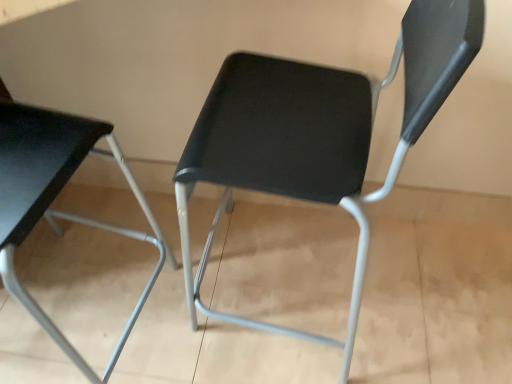
Question: From a real-world perspective, is matte black chair at left, arranged as the 1th chair when viewed from the left, above or below matte black chair at center, positioned as the 2th chair in left-to-right order?

Choices:
 (A) above
 (B) below

Answer: (A)

Question: Does point (33, 168) appear closer or farther from the camera than point (326, 71)?

Choices:
 (A) farther
 (B) closer

Answer: (B)

Question: Is matte black chair at left, arranged as the 1th chair when viewed from the left, wider or thinner than matte black chair at center, positioned as the 2th chair in left-to-right order?

Choices:
 (A) thin
 (B) wide

Answer: (B)

Question: Visually, is matte black chair at center, the first chair in the right-to-left sequence, positioned to the left or to the right of matte black chair at left, which is counted as the 2th chair, starting from the right?

Choices:
 (A) right
 (B) left

Answer: (A)

Question: In the image, is matte black chair at center, the first chair in the right-to-left sequence, positioned in front of or behind matte black chair at left, arranged as the 1th chair when viewed from the left?

Choices:
 (A) front
 (B) behind

Answer: (B)

Question: Considering the positions of point (189, 135) and point (7, 251), is point (189, 135) closer or farther from the camera than point (7, 251)?

Choices:
 (A) closer
 (B) farther

Answer: (B)

Question: Is matte black chair at center, positioned as the 2th chair in left-to-right order, inside the boundaries of matte black chair at left, which is counted as the 2th chair, starting from the right, or outside?

Choices:
 (A) inside
 (B) outside

Answer: (B)